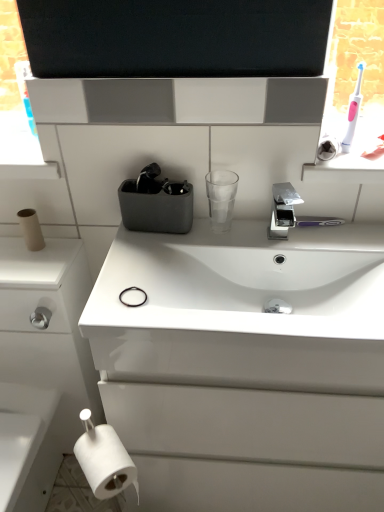
The height and width of the screenshot is (512, 384). What are the coordinates of `vacant space situated on the left part of transparent plastic cup at center` in the screenshot? It's located at point(161,245).